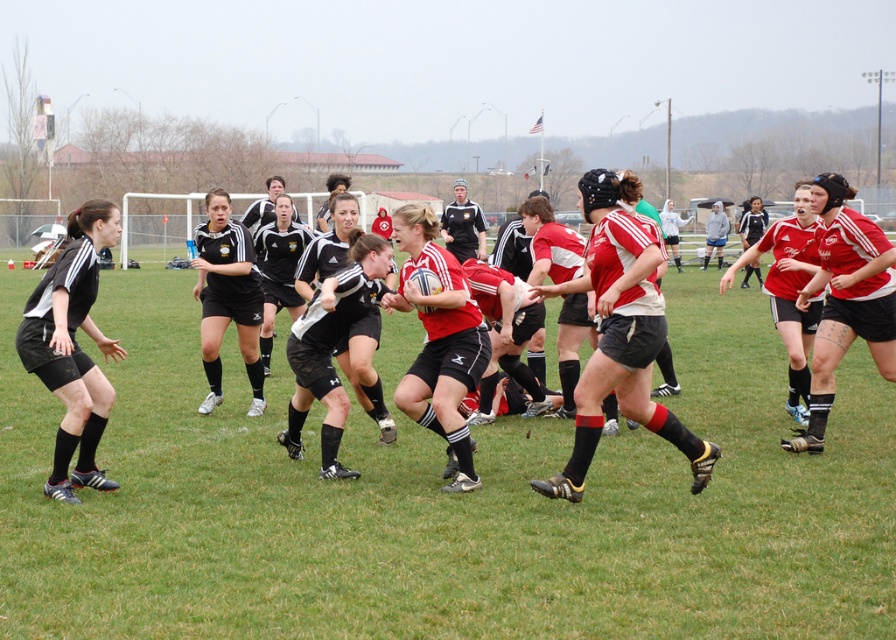
Question: Which point is closer to the camera taking this photo?

Choices:
 (A) (182, 480)
 (B) (66, 474)

Answer: (B)

Question: Among these objects, which one is farthest from the camera?

Choices:
 (A) green grass football field at center
 (B) black matte shorts at left

Answer: (B)

Question: Is the position of green grass football field at center less distant than that of black matte shorts at left?

Choices:
 (A) yes
 (B) no

Answer: (A)

Question: Considering the relative positions of green grass football field at center and black matte shorts at left in the image provided, where is green grass football field at center located with respect to black matte shorts at left?

Choices:
 (A) above
 (B) below

Answer: (B)

Question: Can you confirm if green grass football field at center is positioned to the right of black matte shorts at left?

Choices:
 (A) yes
 (B) no

Answer: (A)